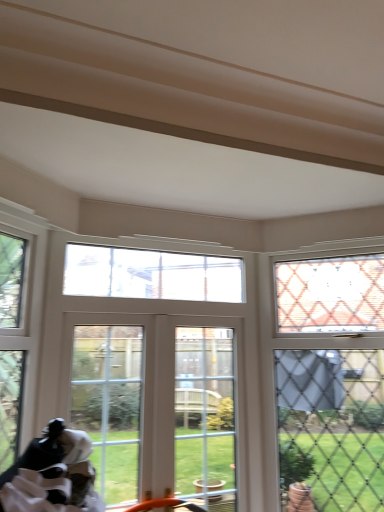
At what (x,y) coordinates should I click in order to perform the action: click on clear glass door at center, the second window when ordered from right to left. Please return your answer as a coordinate pair (x, y). Looking at the image, I should click on (157, 408).

What is the approximate width of clear glass door at center?

It is 12.76 centimeters.

The width and height of the screenshot is (384, 512). What do you see at coordinates (151, 274) in the screenshot?
I see `clear glass window at center, which is counted as the 3th window, starting from the right` at bounding box center [151, 274].

Describe the element at coordinates (19, 326) in the screenshot. This screenshot has width=384, height=512. I see `clear glass window at upper left, which is the 1th window in left-to-right order` at that location.

At what (x,y) coordinates should I click in order to perform the action: click on clear glass door at center, the second window when ordered from right to left. Please return your answer as a coordinate pair (x, y). The width and height of the screenshot is (384, 512). Looking at the image, I should click on (157, 408).

Does clear glass window at center, which is counted as the 3th window, starting from the right, turn towards clear glass door at center?

No, clear glass window at center, which is counted as the 3th window, starting from the right, is not facing towards clear glass door at center.

Is clear glass window at center, the 2th window positioned from the left, next to clear glass door at center?

No.

Considering the sizes of clear glass window at center, the 2th window positioned from the left, and clear glass door at center in the image, is clear glass window at center, the 2th window positioned from the left, wider or thinner than clear glass door at center?

Clearly, clear glass window at center, the 2th window positioned from the left, has less width compared to clear glass door at center.

Between point (308, 455) and point (180, 352), which one is positioned behind?

The point (180, 352) is farther from the camera.

How much distance is there between clear glass window at upper right, which is the 4th window from left to right, and clear glass door at center, the second window when ordered from right to left?

clear glass window at upper right, which is the 4th window from left to right, is 25.29 inches away from clear glass door at center, the second window when ordered from right to left.

Considering the relative positions of clear glass window at upper right, the first window from the right, and clear glass door at center, the second window when ordered from right to left, in the image provided, is clear glass window at upper right, the first window from the right, to the right of clear glass door at center, the second window when ordered from right to left, from the viewer's perspective?

Correct, you'll find clear glass window at upper right, the first window from the right, to the right of clear glass door at center, the second window when ordered from right to left.

In terms of height, does clear glass window at upper right, which is the 4th window from left to right, look taller or shorter compared to clear glass door at center, which is the third window in left-to-right order?

clear glass window at upper right, which is the 4th window from left to right, is taller than clear glass door at center, which is the third window in left-to-right order.

Who is bigger, clear glass door at center, the second window when ordered from right to left, or clear glass window at center, which is counted as the 3th window, starting from the right?

Bigger between the two is clear glass door at center, the second window when ordered from right to left.

The image size is (384, 512). I want to click on window that is the 1st one when counting rightward from the clear glass window at center, which is counted as the 3th window, starting from the right, so click(x=157, y=408).

In the scene shown: Considering the relative sizes of clear glass door at center, which is the third window in left-to-right order, and clear glass window at center, the 2th window positioned from the left, in the image provided, is clear glass door at center, which is the third window in left-to-right order, shorter than clear glass window at center, the 2th window positioned from the left,?

In fact, clear glass door at center, which is the third window in left-to-right order, may be taller than clear glass window at center, the 2th window positioned from the left.

Considering the positions of objects clear glass window at center, the 2th window positioned from the left, and clear glass window at upper right, the first window from the right, in the image provided, who is behind, clear glass window at center, the 2th window positioned from the left, or clear glass window at upper right, the first window from the right,?

clear glass window at center, the 2th window positioned from the left, is further away from the camera.

Considering the sizes of objects clear glass window at center, the 2th window positioned from the left, and clear glass window at upper right, which is the 4th window from left to right, in the image provided, who is smaller, clear glass window at center, the 2th window positioned from the left, or clear glass window at upper right, which is the 4th window from left to right,?

clear glass window at center, the 2th window positioned from the left, is smaller.

Based on the photo, is clear glass window at center, the 2th window positioned from the left, located outside clear glass window at upper right, which is the 4th window from left to right?

Yes.

Is point (127, 268) more distant than point (342, 333)?

No, (127, 268) is in front of (342, 333).

Is clear glass door at center oriented away from clear glass window at upper left, placed as the 4th window when sorted from right to left?

clear glass door at center does not have its back to clear glass window at upper left, placed as the 4th window when sorted from right to left.

Which is more distant, (103, 469) or (8, 359)?

The point (103, 469) is more distant.

Is clear glass door at center surrounding clear glass window at upper left, placed as the 4th window when sorted from right to left?

No, clear glass window at upper left, placed as the 4th window when sorted from right to left, is not surrounded by clear glass door at center.

How much distance is there between clear glass door at center and clear glass window at upper left, which is the 1th window in left-to-right order?

clear glass door at center is 16.51 inches away from clear glass window at upper left, which is the 1th window in left-to-right order.

How much distance is there between clear glass door at center, which is the third window in left-to-right order, and clear glass window at upper left, placed as the 4th window when sorted from right to left?

clear glass door at center, which is the third window in left-to-right order, and clear glass window at upper left, placed as the 4th window when sorted from right to left, are 25.81 inches apart.

From a real-world perspective, is clear glass door at center, the second window when ordered from right to left, positioned over clear glass window at upper left, which is the 1th window in left-to-right order, based on gravity?

Actually, clear glass door at center, the second window when ordered from right to left, is physically below clear glass window at upper left, which is the 1th window in left-to-right order, in the real world.

From the image's perspective, is clear glass door at center, the second window when ordered from right to left, beneath clear glass window at upper left, which is the 1th window in left-to-right order?

Yes, from the image's perspective, clear glass door at center, the second window when ordered from right to left, is beneath clear glass window at upper left, which is the 1th window in left-to-right order.

Is point (132, 494) positioned in front of point (30, 296)?

No, it is not.

Considering the relative sizes of clear glass door at center, the second window when ordered from right to left, and clear glass window at upper right, which is the 4th window from left to right, in the image provided, is clear glass door at center, the second window when ordered from right to left, bigger than clear glass window at upper right, which is the 4th window from left to right,?

No.

From the image's perspective, is clear glass door at center, the second window when ordered from right to left, above clear glass window at upper right, the first window from the right?

No.

Can you tell me how much clear glass door at center, the second window when ordered from right to left, and clear glass window at upper right, which is the 4th window from left to right, differ in facing direction?

The facing directions of clear glass door at center, the second window when ordered from right to left, and clear glass window at upper right, which is the 4th window from left to right, are 44.3 degrees apart.

Does point (224, 440) come in front of point (352, 359)?

No, it is not.

Where is `screen door that appears below the clear glass window at center, which is counted as the 3th window, starting from the right (from a real-world perspective)`? The height and width of the screenshot is (512, 384). screen door that appears below the clear glass window at center, which is counted as the 3th window, starting from the right (from a real-world perspective) is located at coordinates (109, 404).

This screenshot has height=512, width=384. I want to click on window that appears on the right of clear glass door at center, which is the third window in left-to-right order, so click(x=331, y=382).

Looking at the image, which one is located further to clear glass door at center, the second window when ordered from right to left, white glass door at center or clear glass window at upper left, placed as the 4th window when sorted from right to left?

clear glass window at upper left, placed as the 4th window when sorted from right to left.

Looking at the image, which one is located closer to clear glass door at center, which is the third window in left-to-right order, white glass door at center or clear glass window at upper right, which is the 4th window from left to right?

white glass door at center is closer to clear glass door at center, which is the third window in left-to-right order.

Based on their spatial positions, is clear glass window at center, which is counted as the 3th window, starting from the right, or clear glass window at upper left, placed as the 4th window when sorted from right to left, closer to clear glass door at center, which is the third window in left-to-right order?

Among the two, clear glass window at center, which is counted as the 3th window, starting from the right, is located nearer to clear glass door at center, which is the third window in left-to-right order.

Based on their spatial positions, is clear glass window at upper right, which is the 4th window from left to right, or clear glass door at center, which is the third window in left-to-right order, closer to clear glass window at upper left, which is the 1th window in left-to-right order?

clear glass door at center, which is the third window in left-to-right order, is positioned closer to the anchor clear glass window at upper left, which is the 1th window in left-to-right order.

Which object lies further to the anchor point clear glass window at upper right, the first window from the right, clear glass window at upper left, which is the 1th window in left-to-right order, or white glass door at center?

clear glass window at upper left, which is the 1th window in left-to-right order, is positioned further to the anchor clear glass window at upper right, the first window from the right.

Looking at the image, which one is located closer to white glass door at center, clear glass door at center, the second window when ordered from right to left, or clear glass door at center?

The object closer to white glass door at center is clear glass door at center, the second window when ordered from right to left.

Based on their spatial positions, is clear glass window at upper right, which is the 4th window from left to right, or clear glass window at center, the 2th window positioned from the left, further from clear glass door at center?

The object further to clear glass door at center is clear glass window at upper right, which is the 4th window from left to right.

Considering their positions, is clear glass door at center positioned further to clear glass door at center, the second window when ordered from right to left, than white glass door at center?

Among the two, clear glass door at center is located further to clear glass door at center, the second window when ordered from right to left.

Where is `window frame located between clear glass door at center, which is the third window in left-to-right order, and clear glass window at upper right, which is the 4th window from left to right, in the left-right direction`? The height and width of the screenshot is (512, 384). window frame located between clear glass door at center, which is the third window in left-to-right order, and clear glass window at upper right, which is the 4th window from left to right, in the left-right direction is located at coordinates (205, 416).

Locate an element on the screen. The width and height of the screenshot is (384, 512). screen door between clear glass window at center, which is counted as the 3th window, starting from the right, and white glass door at center from top to bottom is located at coordinates tap(109, 404).

Find the location of a particular element. screen door located between clear glass window at upper left, which is the 1th window in left-to-right order, and clear glass window at upper right, which is the 4th window from left to right, in the left-right direction is located at coordinates (109, 404).

Identify the location of window frame situated between clear glass window at center, the 2th window positioned from the left, and clear glass window at upper right, the first window from the right, from left to right. This screenshot has height=512, width=384. (205, 416).